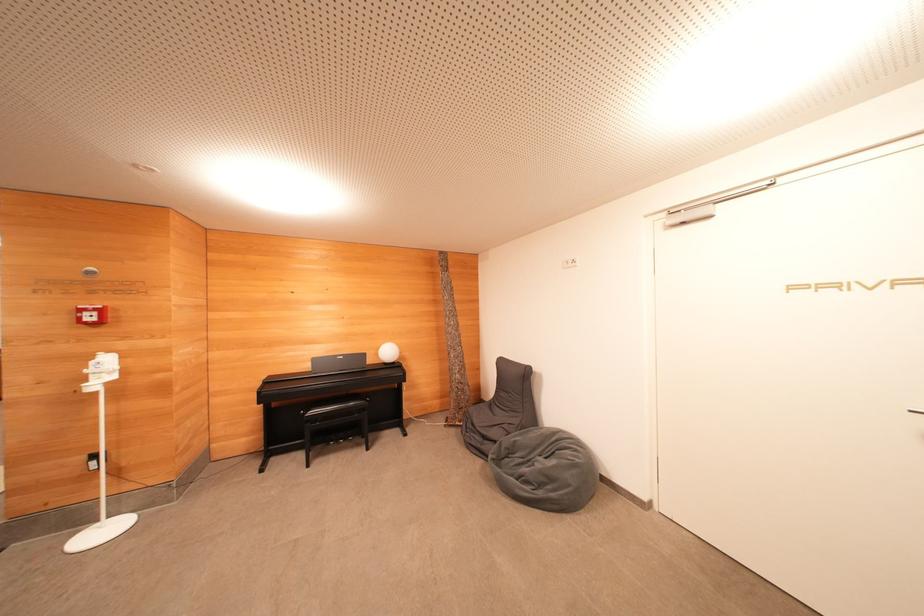
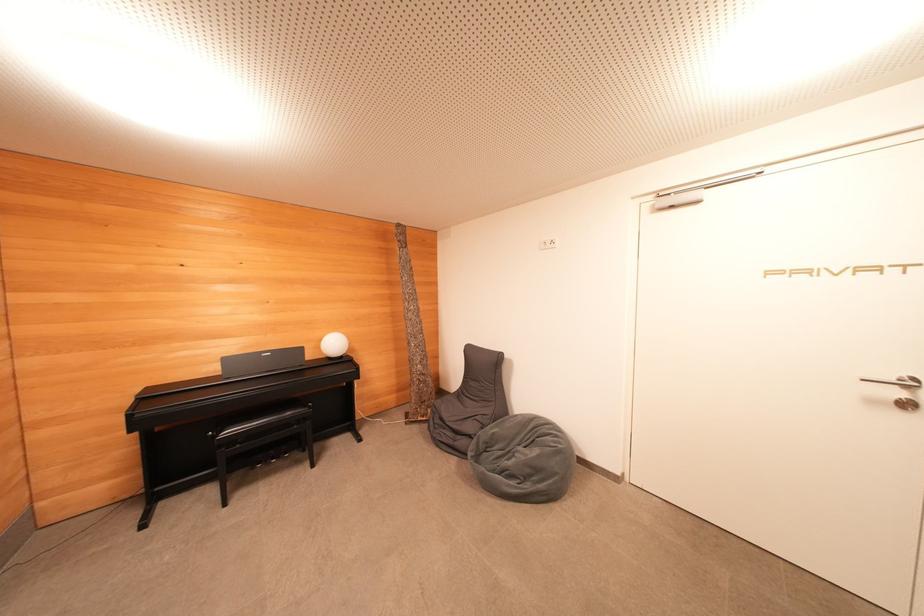
Question: How did the camera likely rotate?

Choices:
 (A) Left
 (B) Right
 (C) Up
 (D) Down

Answer: (B)